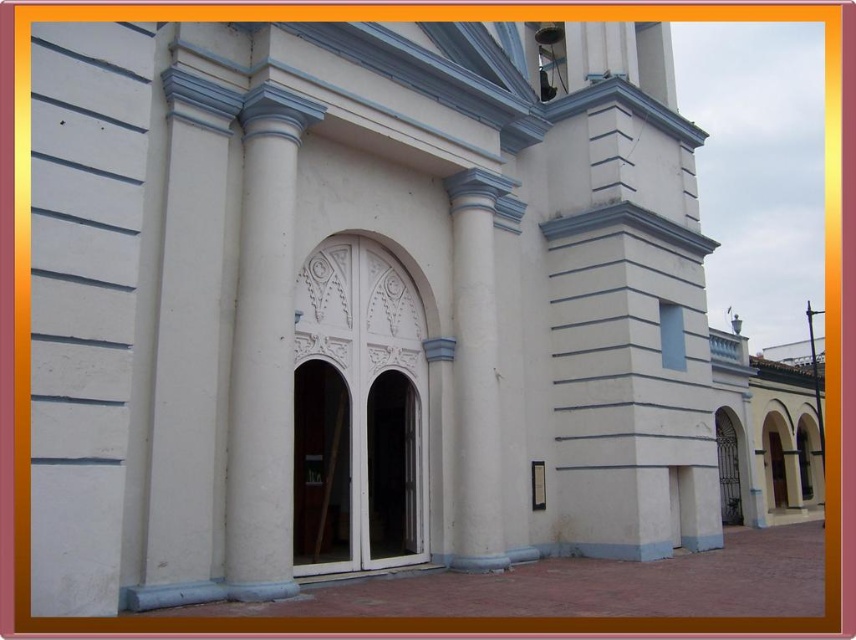
Does white glossy column at center appear on the left side of white smooth column at center?

Yes, white glossy column at center is to the left of white smooth column at center.

The height and width of the screenshot is (640, 856). I want to click on white glossy column at center, so click(x=263, y=352).

Image resolution: width=856 pixels, height=640 pixels. Find the location of `white glossy column at center`. white glossy column at center is located at coordinates (263, 352).